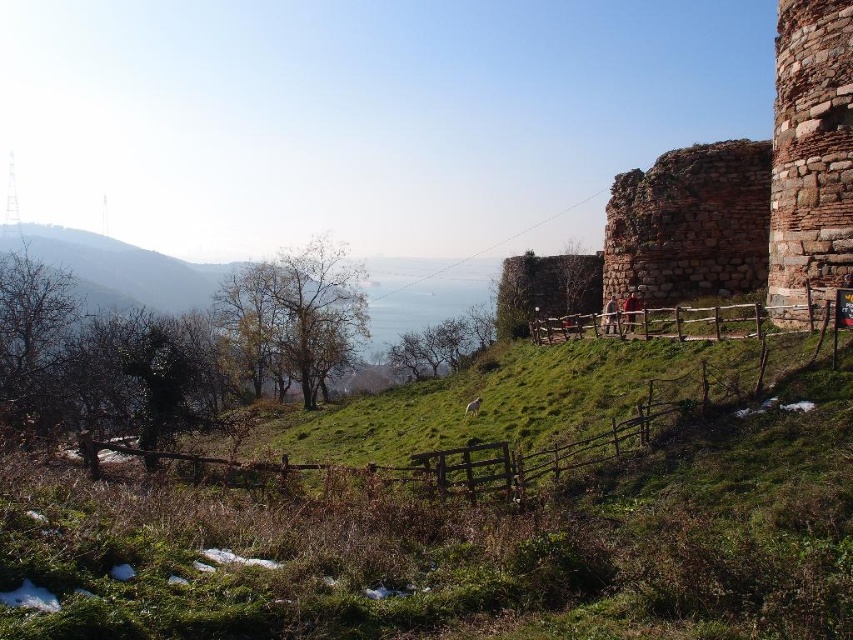
You are planning to set up a picnic blanket on the grassy area. Given the green grassy at center and the rustic stone wall at upper right, which area has a wider space for spreading the blanket?

The green grassy at center has a wider space than the rustic stone wall at upper right, so it is better for spreading the picnic blanket.

From the picture: What is the exact coordinate of the green grassy at center in the image?

The green grassy at center is located at point (471,512).